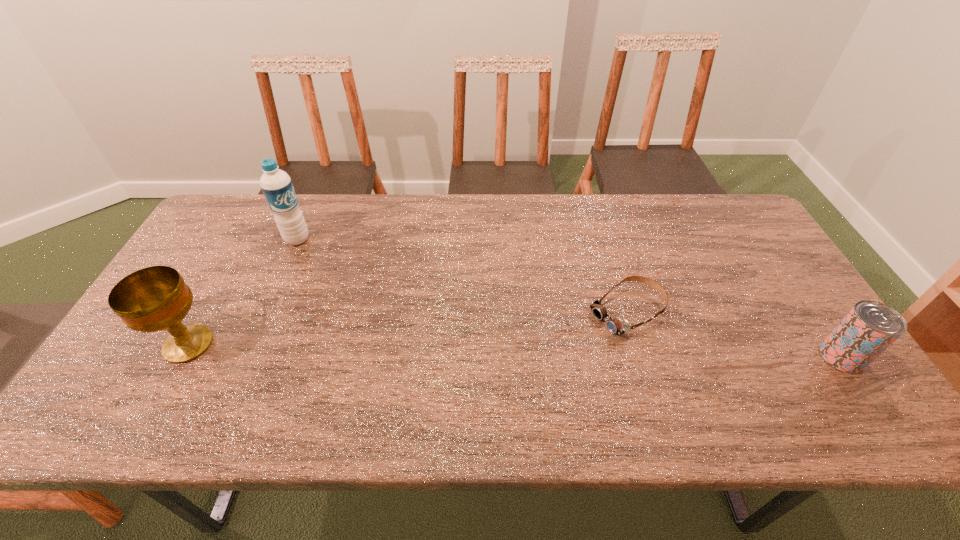
What are the coordinates of `unoccupied area between the second tallest object and the shortest object` in the screenshot? It's located at (408, 328).

Where is `free point between the shortest object and the beer can`? The width and height of the screenshot is (960, 540). free point between the shortest object and the beer can is located at coordinates (734, 335).

This screenshot has height=540, width=960. Identify the location of vacant space that's between the goggles and the tallest object. (462, 276).

This screenshot has width=960, height=540. I want to click on free space between the beer can and the chalice, so click(515, 350).

Where is `unoccupied area between the second object from left to right and the beer can`? This screenshot has height=540, width=960. unoccupied area between the second object from left to right and the beer can is located at coordinates (569, 298).

Where is `free space that is in between the rightmost object and the tallest object`? free space that is in between the rightmost object and the tallest object is located at coordinates (569, 298).

Image resolution: width=960 pixels, height=540 pixels. I want to click on free space between the third object from right to left and the leftmost object, so click(243, 292).

The width and height of the screenshot is (960, 540). In order to click on vacant space that is in between the chalice and the goggles in this screenshot , I will do `click(408, 328)`.

Where is `vacant area that lies between the beer can and the third object from left to right`? The width and height of the screenshot is (960, 540). vacant area that lies between the beer can and the third object from left to right is located at coordinates (734, 335).

Select which object appears as the third closest to the beer can. Please provide its 2D coordinates. Your answer should be formatted as a tuple, i.e. [(x, y)], where the tuple contains the x and y coordinates of a point satisfying the conditions above.

[(156, 298)]